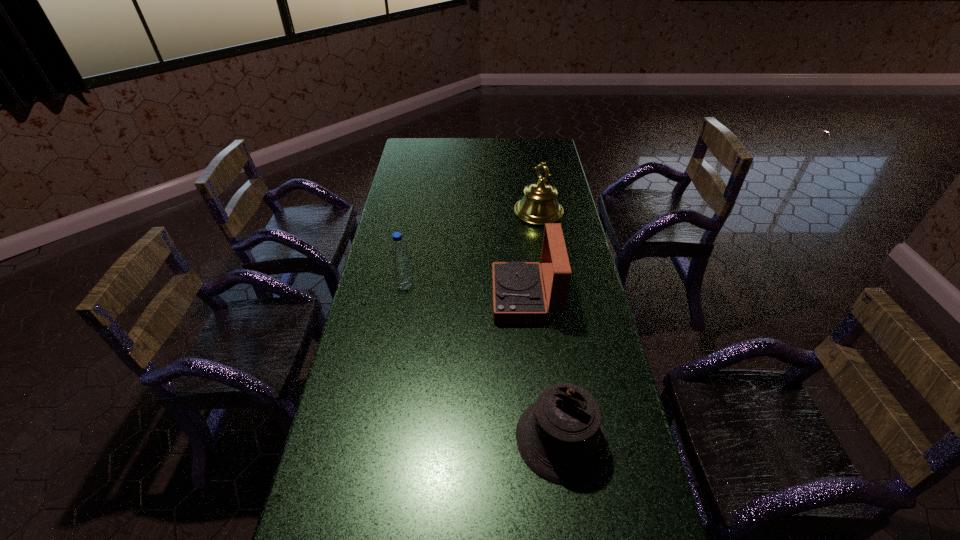
At what (x,y) coordinates should I click in order to perform the action: click on free location that satisfies the following two spatial constraints: 1. on the face of the phonograph record; 2. on the left side of the nearer bell. Please return your answer as a coordinate pair (x, y). Looking at the image, I should click on (540, 438).